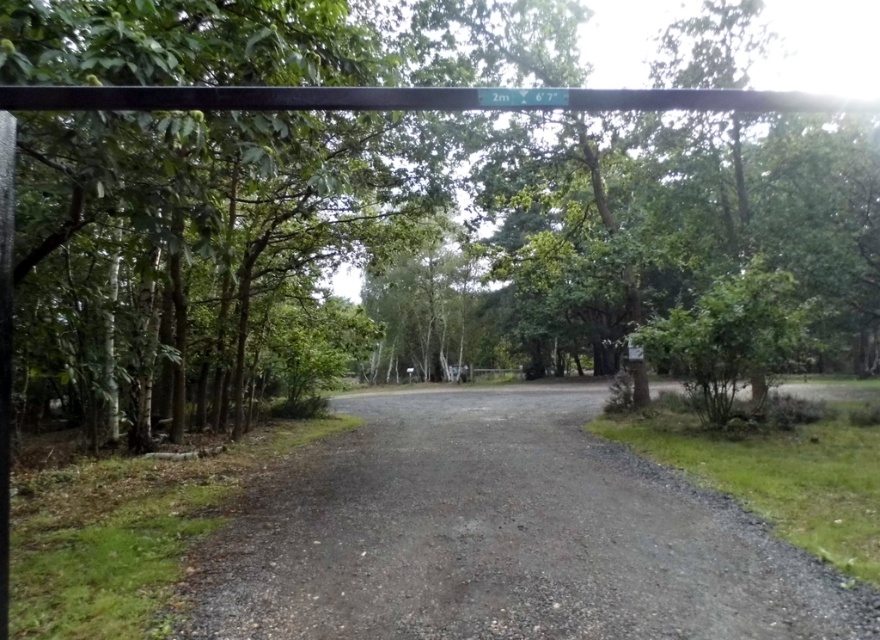
You are driving a truck that is 2.5 meters tall and need to pass under the green plastic sign at upper center. There is a green leafy tree at upper center nearby. Is the truck able to pass under the sign without hitting the tree?

The green leafy tree at upper center is 5.66 meters away from the green plastic sign at upper center. Since the distance between them is more than the truck height of 2.5 meters, the truck can safely pass under the sign without hitting the tree.

You are driving a tall truck and see the black metal pole at upper center and the green plastic sign at upper center ahead on the road. The sign says 2m 6 feet 7 inches. Can your truck pass under both without hitting them?

Result: The black metal pole at upper center is bigger than the green plastic sign at upper center, so the truck must ensure it is under 2m 6 feet 7 inches to pass safely under both objects. However, since the pole is larger, it might have a lower clearance. Check the exact height before proceeding.